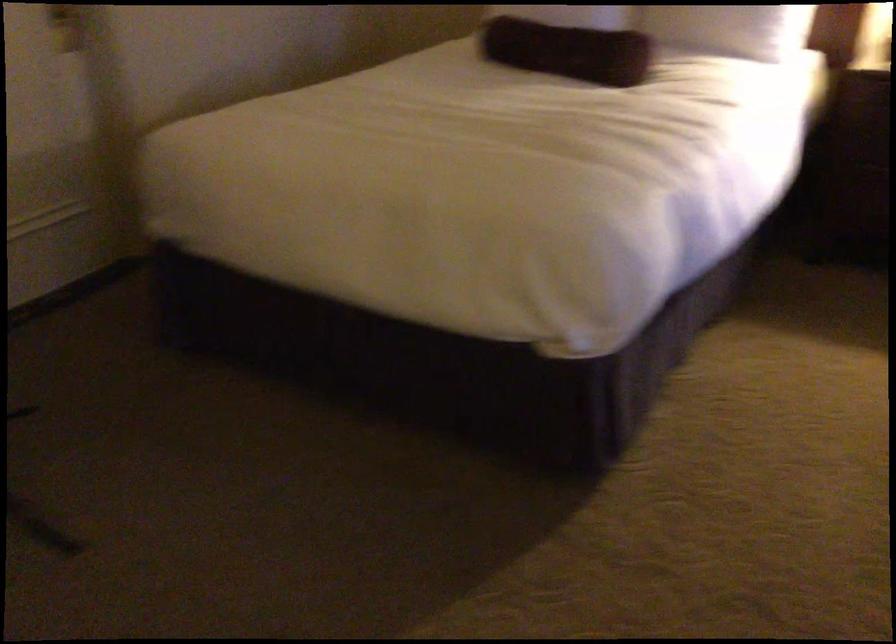
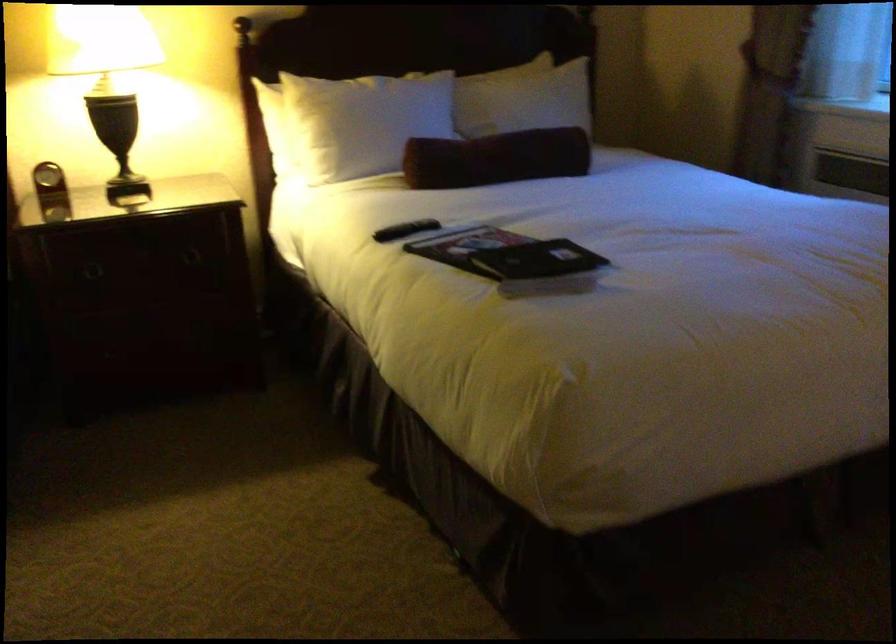
Question: The camera is either moving clockwise (left) or counter-clockwise (right) around the object. The first image is from the beginning of the video and the second image is from the end. Is the camera moving left or right when shooting the video?

Choices:
 (A) Left
 (B) Right

Answer: (A)